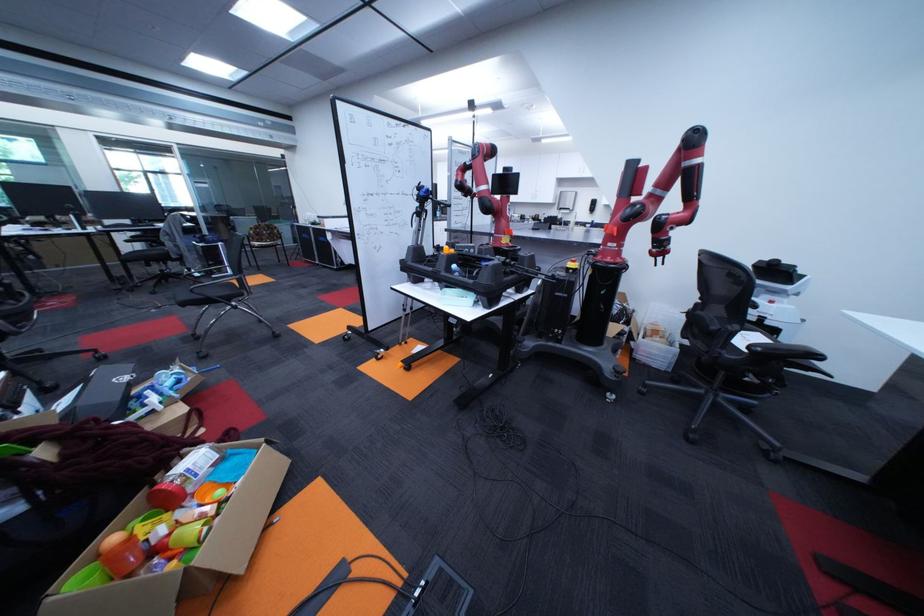
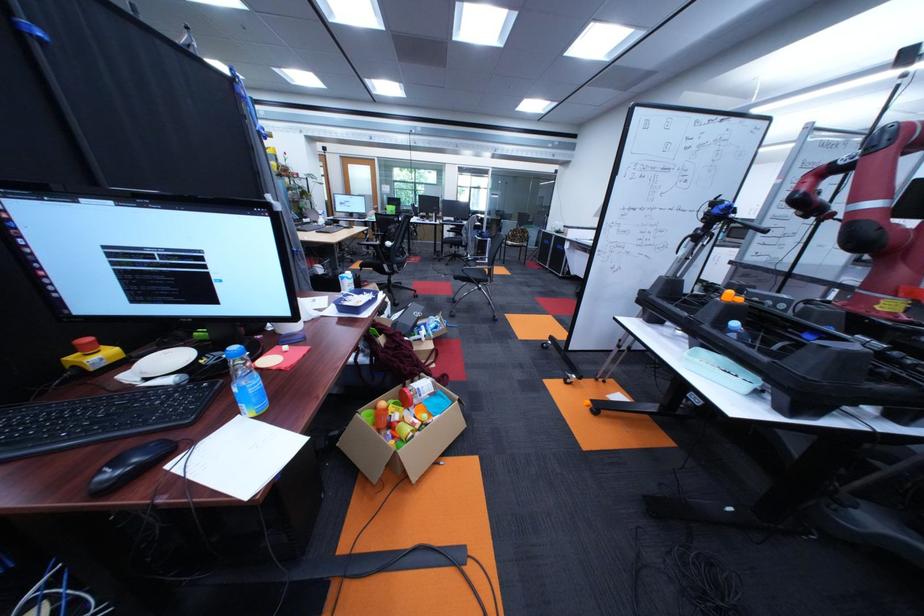
Question: Based on the continuous images, in which direction is the camera rotating? Reply with the corresponding letter.

Choices:
 (A) Left
 (B) Right
 (C) Up
 (D) Down

Answer: (A)